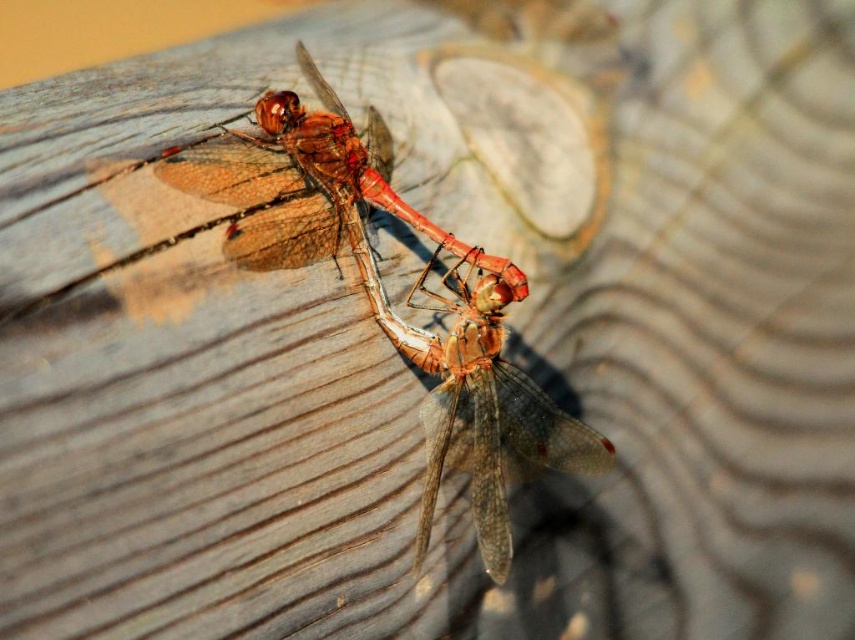
Based on the photo, you are observing two dragonflies on a wooden surface. The dragonflies are positioned in a way that suggests they might be mating, with their bodies aligned and wings slightly overlapping. You see the translucent amber dragonfly at center. Where is it located in relation to the other dragonfly?

The translucent amber dragonfly at center is located at point (470, 388), which is the central position relative to the other dragonfly in this arrangement.

Consider the image. You are observing two dragonflies on a wooden surface. You notice the translucent amber wings at center and the translucent amber dragonfly at center. Which one is positioned closer to you?

→ The translucent amber wings at center are closer to the viewer than the translucent amber dragonfly at center.